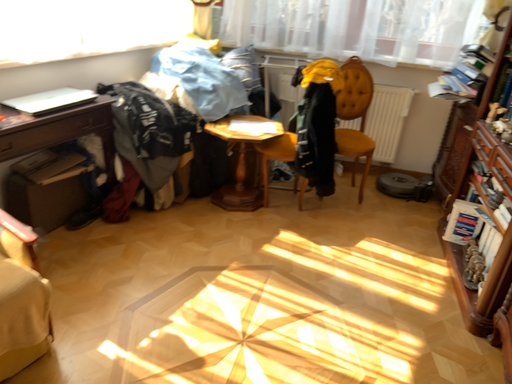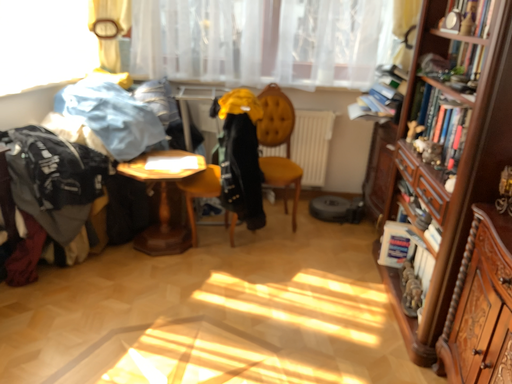
Question: How did the camera likely rotate when shooting the video?

Choices:
 (A) rotated left
 (B) rotated right

Answer: (B)